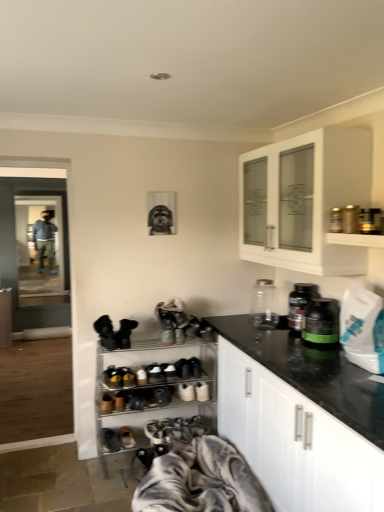
I want to click on vacant area on top of white matte cabinet at lower right, placed as the third cabinetry when sorted from back to front (from a real-world perspective), so 312,361.